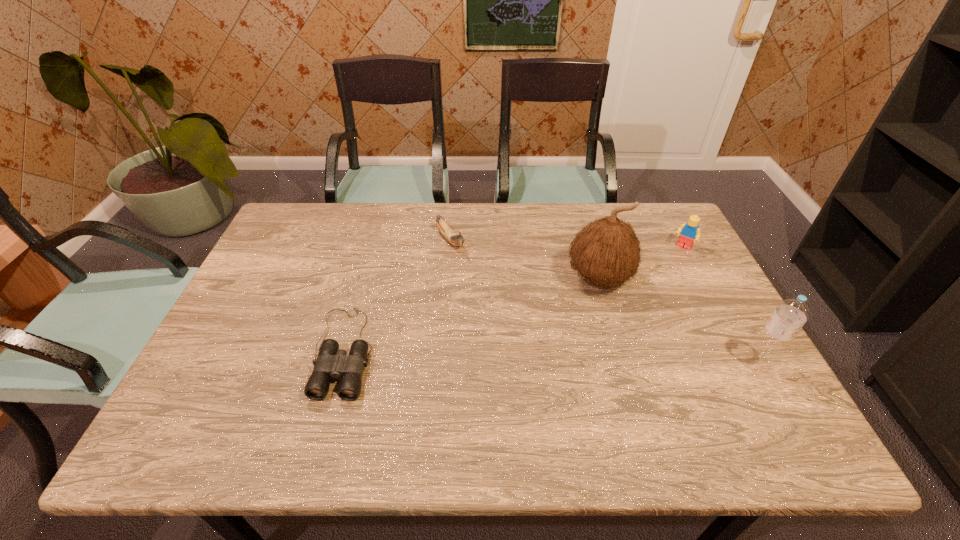
Point out which object is positioned as the fourth nearest to the third tallest object. Please provide its 2D coordinates. Your answer should be formatted as a tuple, i.e. [(x, y)], where the tuple contains the x and y coordinates of a point satisfying the conditions above.

[(332, 362)]

Find the location of a particular element. The width and height of the screenshot is (960, 540). free space that satisfies the following two spatial constraints: 1. on the back side of the third object from right to left; 2. on the right side of the third tallest object is located at coordinates (590, 248).

At what (x,y) coordinates should I click in order to perform the action: click on free space that satisfies the following two spatial constraints: 1. at the eyepiece of the binoculars; 2. on the right side of the water bottle. Please return your answer as a coordinate pair (x, y). The width and height of the screenshot is (960, 540). Looking at the image, I should click on (341, 363).